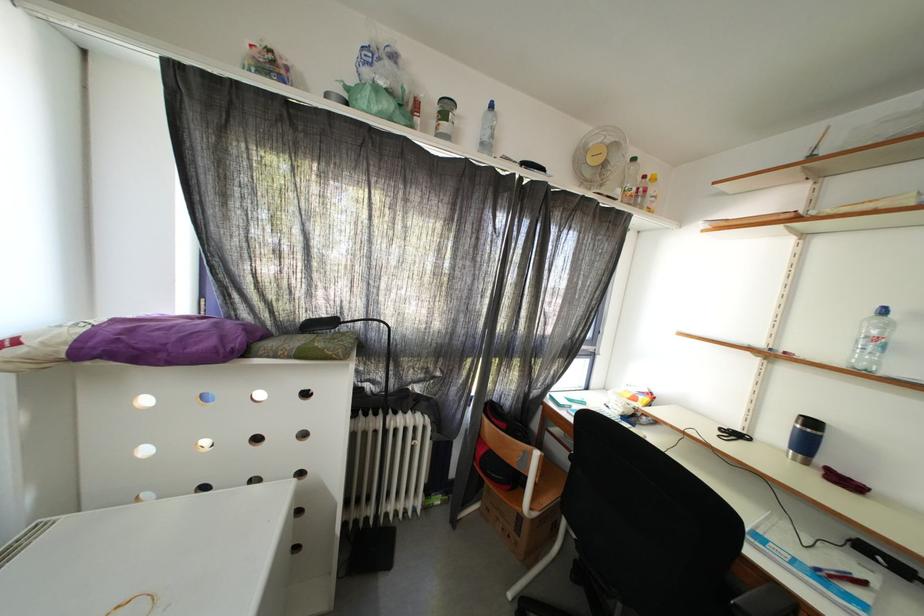
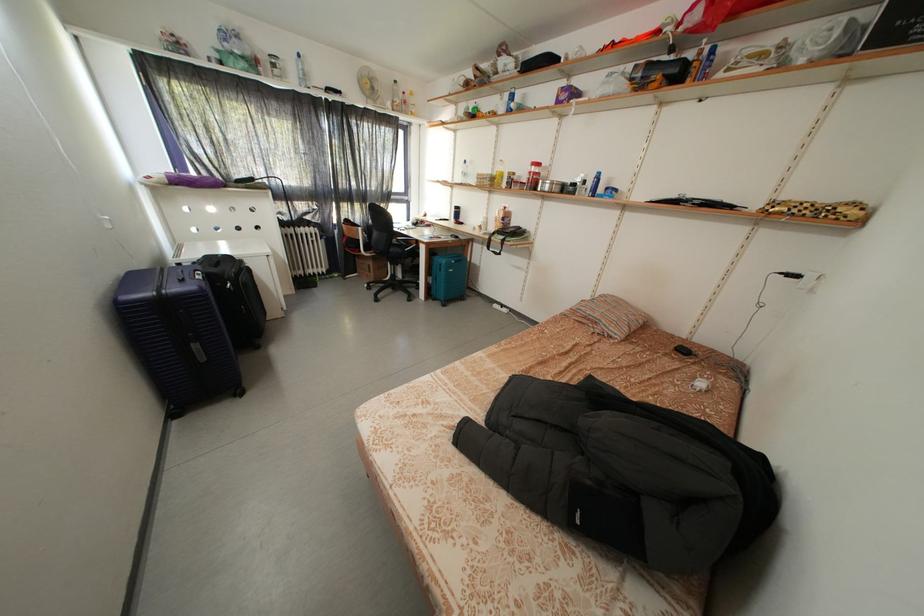
The point at (892, 315) is marked in the first image. Where is the corresponding point in the second image?

(472, 167)